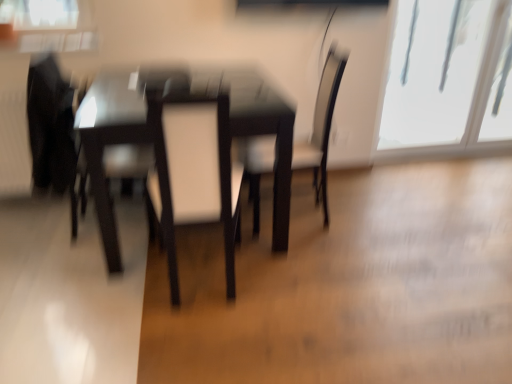
Find the location of `vacant area that lies between white leather swivel chair at center, arranged as the first swivel chair when viewed from the right, and glossy dark wood table at center`. vacant area that lies between white leather swivel chair at center, arranged as the first swivel chair when viewed from the right, and glossy dark wood table at center is located at coordinates (247, 269).